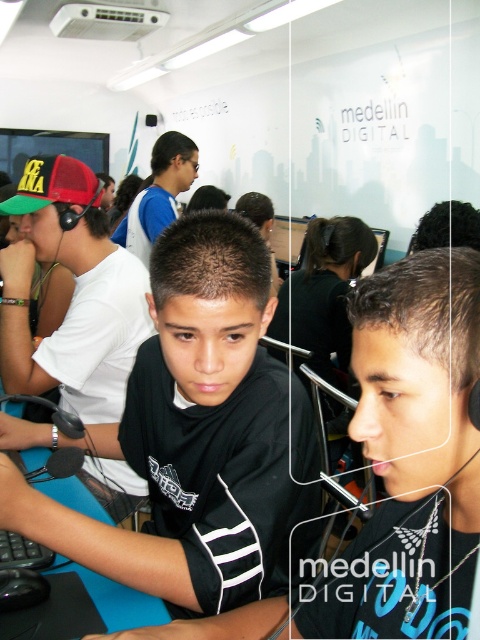
You are standing at the entrance of the room and want to approach the person wearing the black matte shirt at center to ask a question. Based on the coordinates provided in the description, in which general direction should you move from your current position?

The black matte shirt at center is located at point 0.684 in the x coordinate and 0.404 in the y coordinate. Since you are at the entrance, which is typically near the lower left corner of the room, you should move towards the upper right direction to reach the person wearing the black matte shirt at center.

Consider the image. You are a photographer standing 10 feet away from the two people in the image, both wearing black tops. You want to take a photo of them together without any part of their shirts being cut off. What is the minimum width of the camera lens you need to capture both the black matte shirt at center and the black jersey at center in the frame?

The black matte shirt at center is 8.92 inches from the black jersey at center. To capture both in the frame without any part being cut off, the camera lens must have a minimum width of at least 8.92 inches.